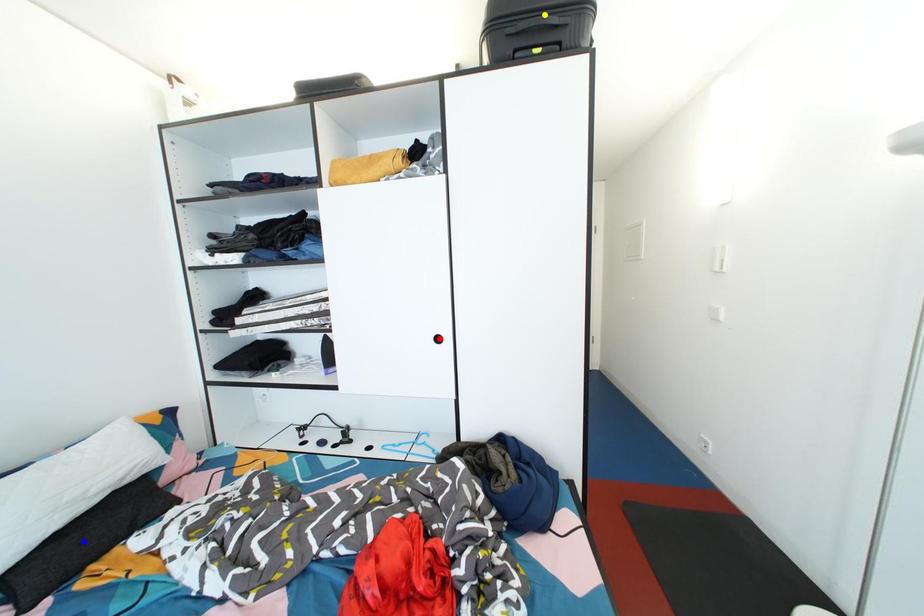
Order these from nearest to farthest:
yellow point
blue point
red point

red point → yellow point → blue point